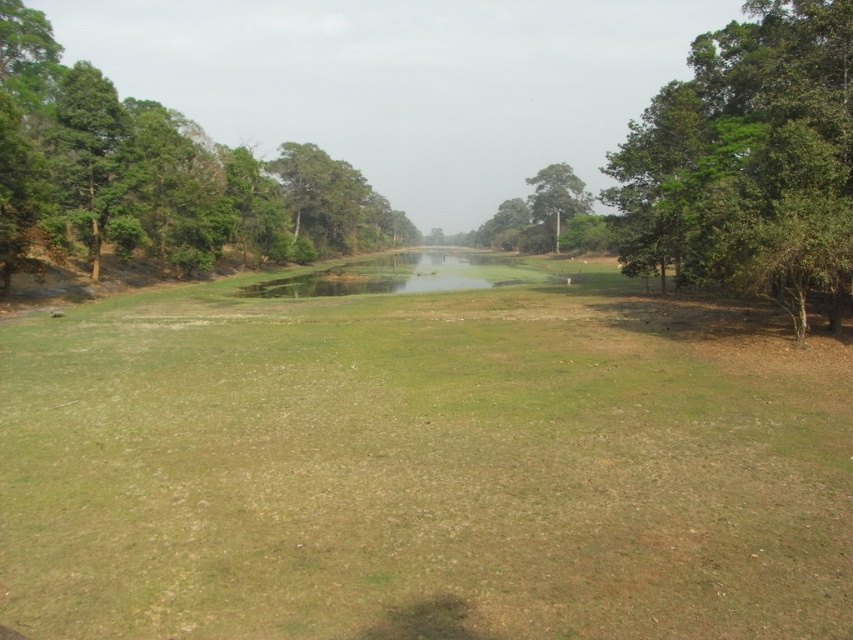
Question: Which of the following is the closest to the observer?

Choices:
 (A) green leafy tree at right
 (B) green leafy tree at left

Answer: (A)

Question: Which of the following is the closest to the observer?

Choices:
 (A) green grassy field at center
 (B) green leafy tree at right

Answer: (A)

Question: Does green grassy field at center have a larger size compared to green leafy tree at left?

Choices:
 (A) no
 (B) yes

Answer: (A)

Question: Does green grassy field at center appear on the right side of green leafy tree at right?

Choices:
 (A) yes
 (B) no

Answer: (B)

Question: Does green grassy field at center appear on the left side of green leafy tree at left?

Choices:
 (A) yes
 (B) no

Answer: (B)

Question: Which of the following is the closest to the observer?

Choices:
 (A) green leafy tree at left
 (B) green leafy tree at right

Answer: (B)